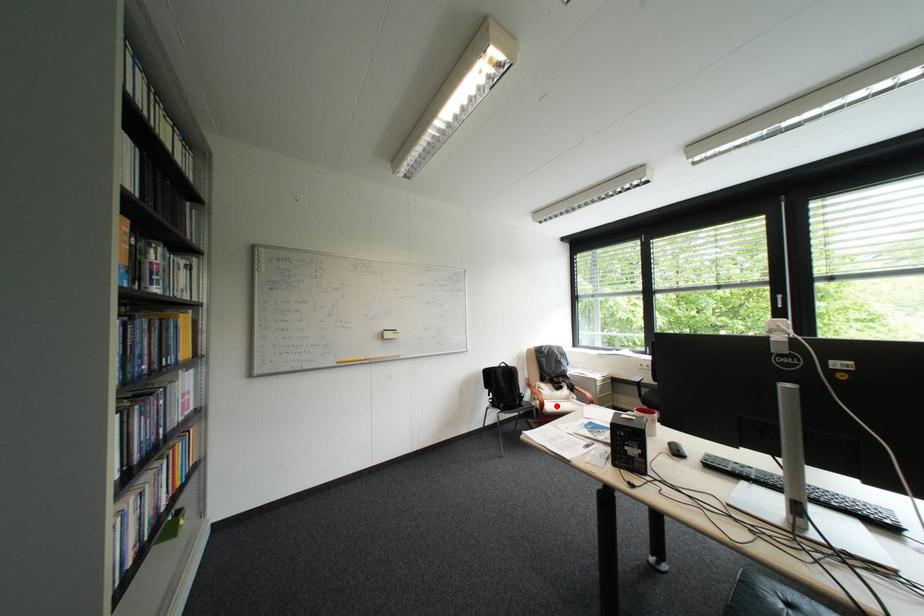
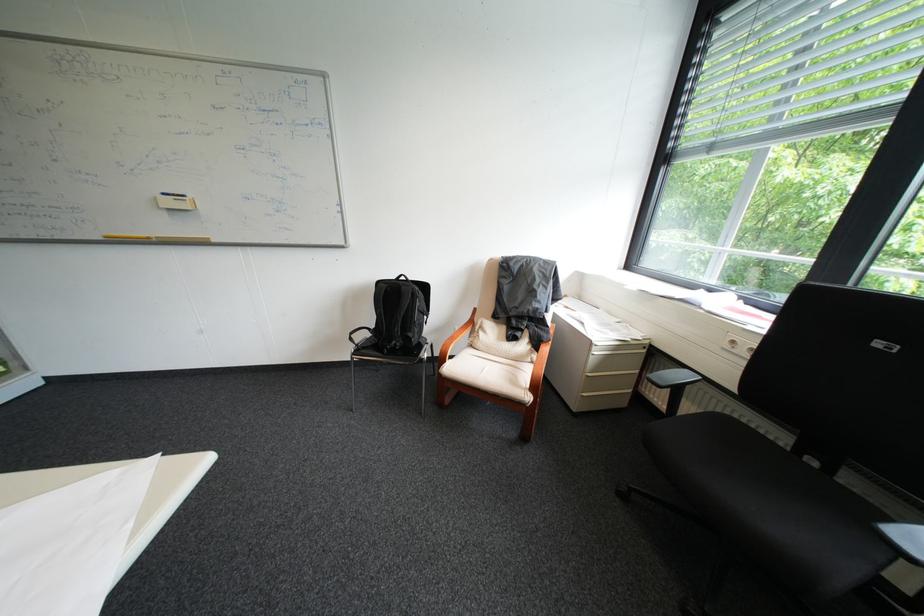
In the second image, find the point that corresponds to the highlighted location in the first image.

(456, 363)